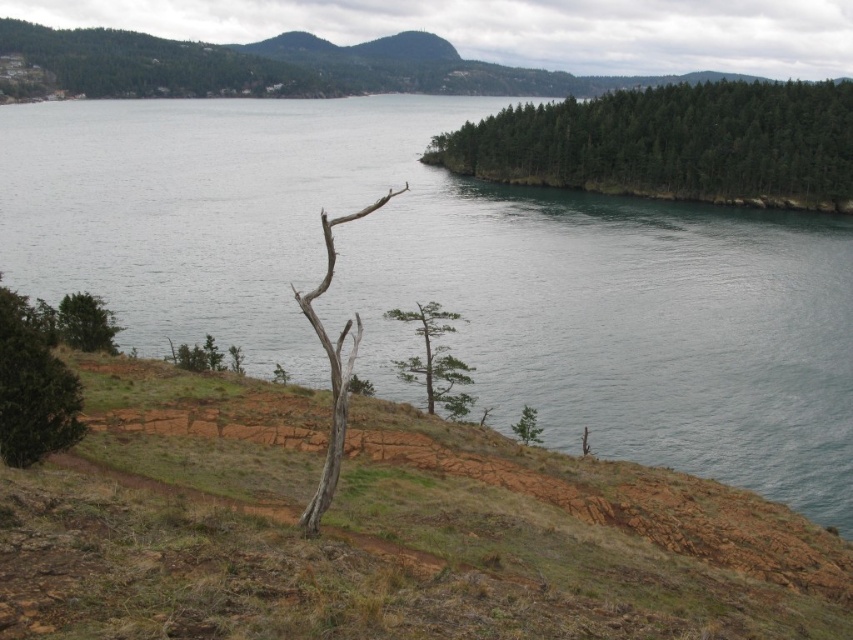
Question: Observing the image, what is the correct spatial positioning of green matte tree at center in reference to green matte tree at lower right?

Choices:
 (A) right
 (B) left

Answer: (B)

Question: Can you confirm if greenish-blue water at center is positioned above green matte tree at lower right?

Choices:
 (A) yes
 (B) no

Answer: (A)

Question: Among these objects, which one is farthest from the camera?

Choices:
 (A) green matte tree at center
 (B) dead wood tree at center

Answer: (A)

Question: Which point is farther to the camera?

Choices:
 (A) green matte bush at left
 (B) dead wood tree at center
 (C) greenish-blue water at center

Answer: (C)

Question: Which point is farther to the camera?

Choices:
 (A) (15, 465)
 (B) (338, 337)
 (C) (100, 333)
 (D) (450, 394)

Answer: (C)

Question: Where is green matte forest at upper right located in relation to green matte tree at left in the image?

Choices:
 (A) right
 (B) left

Answer: (A)